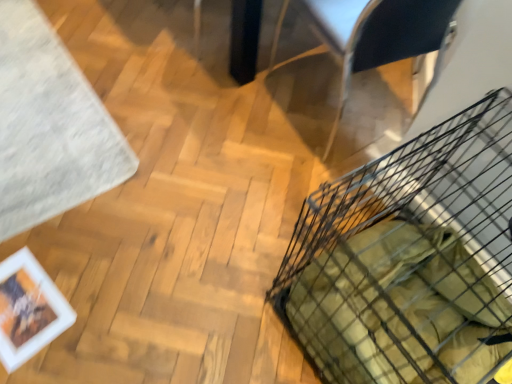
Where is `free area behind white matte picture frame at lower left`? free area behind white matte picture frame at lower left is located at coordinates (54, 235).